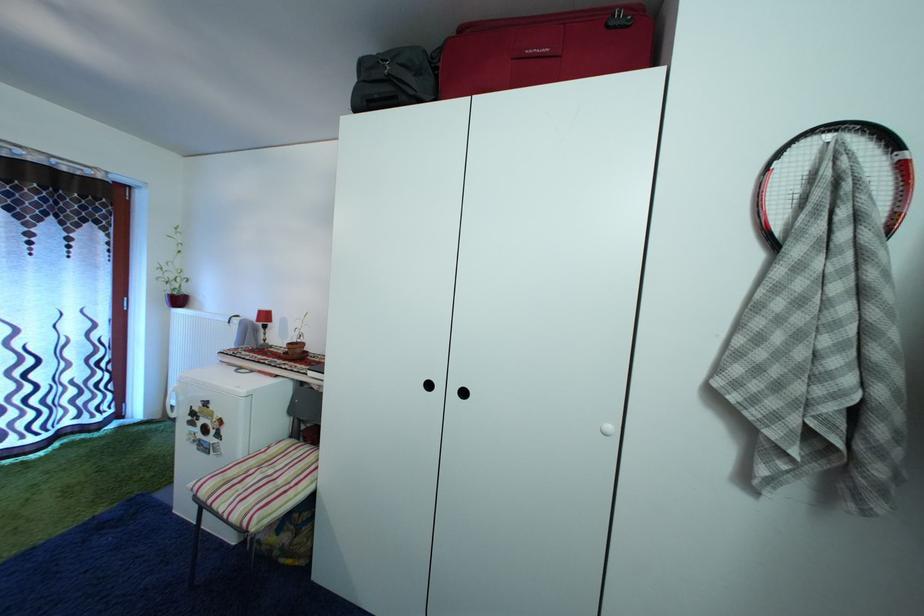
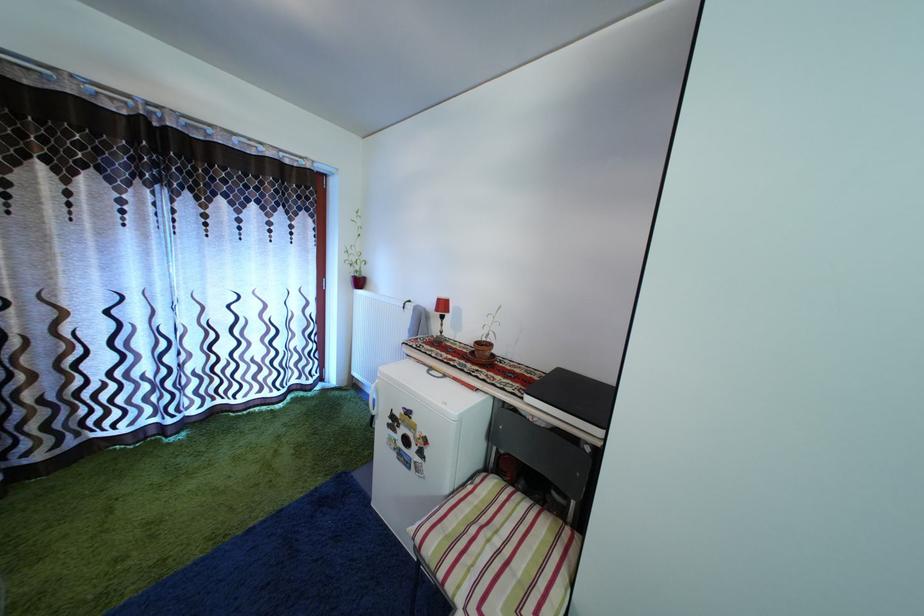
Find the pixel in the second image that matches [278,479] in the first image.

(505, 549)